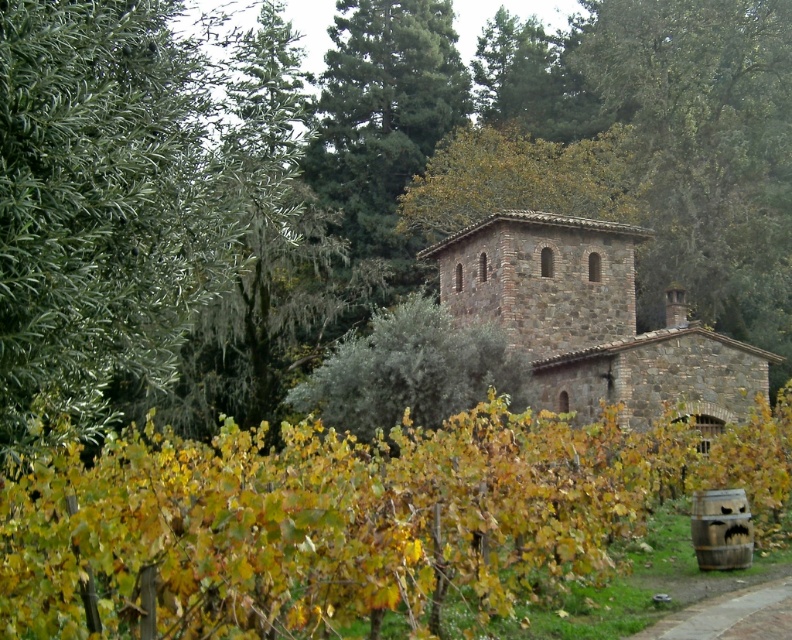
Question: In this image, where is green leafy vineyard at center located relative to brick paved path at lower right?

Choices:
 (A) above
 (B) below

Answer: (A)

Question: Among these points, which one is nearest to the camera?

Choices:
 (A) (486, 380)
 (B) (334, 33)
 (C) (284, 490)

Answer: (C)

Question: Which point is farther to the camera?

Choices:
 (A) green leafy tree at center
 (B) green leafy tree at left

Answer: (A)

Question: Which object is the farthest from the green leafy vineyard at center?

Choices:
 (A) green leafy tree at center
 (B) green textured pine tree at upper center
 (C) brick paved path at lower right

Answer: (B)

Question: From the image, what is the correct spatial relationship of green leafy tree at left in relation to green textured pine tree at upper center?

Choices:
 (A) left
 (B) right

Answer: (A)

Question: Where is green textured pine tree at upper center located in relation to green leafy tree at center in the image?

Choices:
 (A) right
 (B) left

Answer: (B)